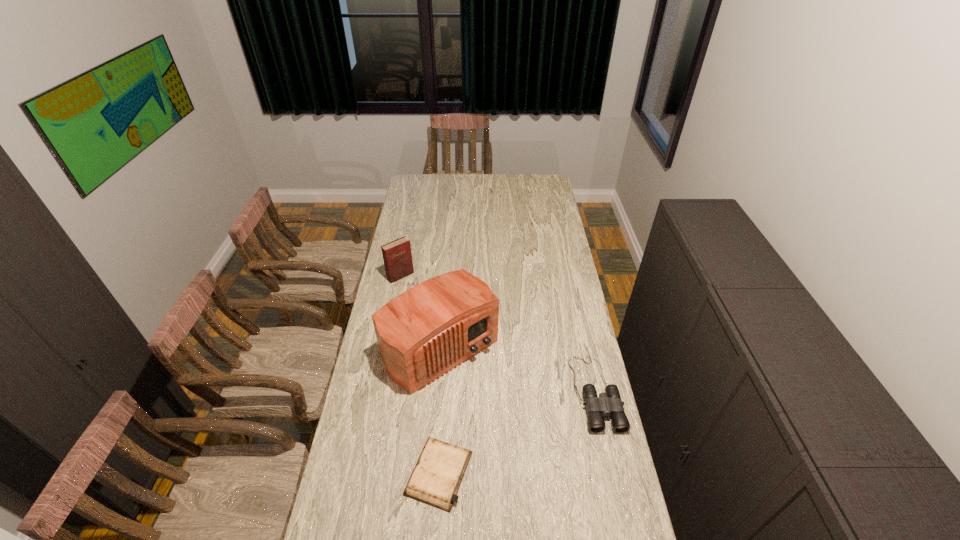
Identify the location of free spot on the desktop that is between the nearest object and the rightmost object and is positioned on the front-facing side of the radio receiver. (517, 433).

The height and width of the screenshot is (540, 960). Find the location of `vacant space on the desktop that is between the right diary and the binoculars and is positioned on the front cover of the farthest object`. vacant space on the desktop that is between the right diary and the binoculars and is positioned on the front cover of the farthest object is located at coordinates point(540,422).